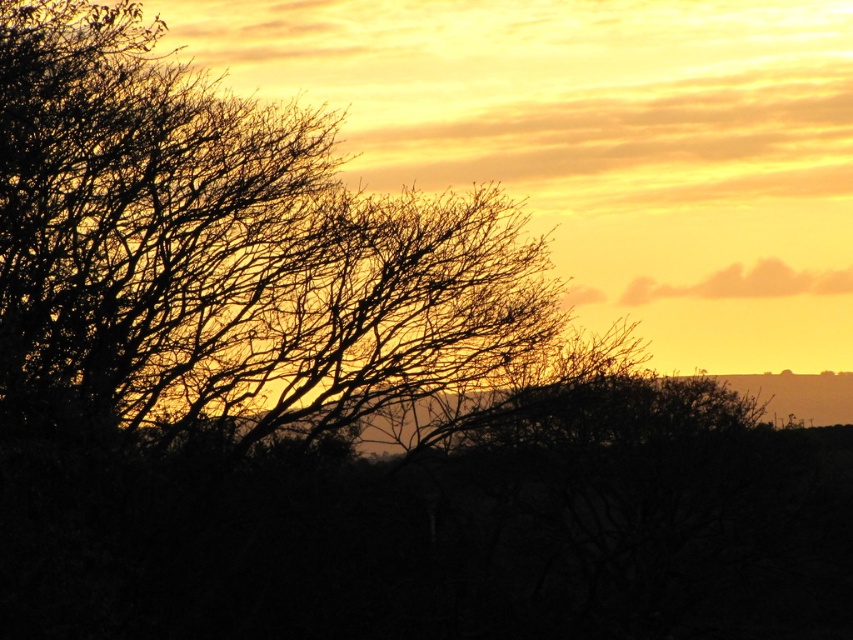
Question: Which of the following is the farthest from the observer?

Choices:
 (A) (672, 294)
 (B) (135, 196)

Answer: (A)

Question: Does silhouette branches at left appear over cloudy orange sky at upper right?

Choices:
 (A) no
 (B) yes

Answer: (A)

Question: Is silhouette branches at left below cloudy orange sky at upper right?

Choices:
 (A) no
 (B) yes

Answer: (B)

Question: Which object appears farthest from the camera in this image?

Choices:
 (A) cloudy orange sky at upper right
 (B) silhouette branches at left

Answer: (A)

Question: Can you confirm if silhouette branches at left is smaller than cloudy orange sky at upper right?

Choices:
 (A) no
 (B) yes

Answer: (A)